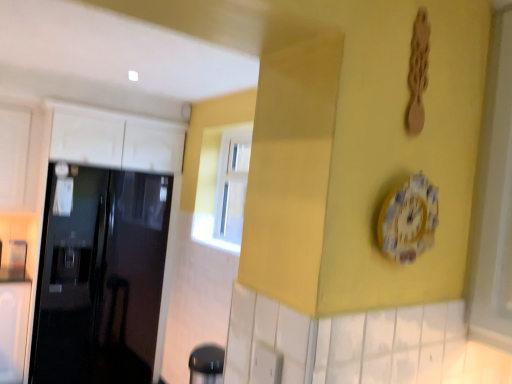
The image size is (512, 384). I want to click on porcelain floral clock at center, so click(x=408, y=219).

The width and height of the screenshot is (512, 384). What do you see at coordinates (408, 219) in the screenshot?
I see `porcelain floral clock at center` at bounding box center [408, 219].

What do you see at coordinates (101, 278) in the screenshot?
I see `glossy black door at left` at bounding box center [101, 278].

The image size is (512, 384). In order to click on glossy black door at left in this screenshot , I will do `click(101, 278)`.

What is the approximate height of glossy black door at left?

It is 1.75 meters.

At what (x,y) coordinates should I click in order to perform the action: click on porcelain floral clock at center. Please return your answer as a coordinate pair (x, y). Looking at the image, I should click on (408, 219).

Visually, is glossy black door at left positioned to the left or to the right of porcelain floral clock at center?

In the image, glossy black door at left appears on the left side of porcelain floral clock at center.

Is the position of glossy black door at left more distant than that of porcelain floral clock at center?

That is True.

Does point (84, 273) appear closer or farther from the camera than point (400, 198)?

Point (84, 273) is farther from the camera than point (400, 198).

From the image's perspective, relative to porcelain floral clock at center, is glossy black door at left above or below?

glossy black door at left is below porcelain floral clock at center.

From a real-world perspective, is glossy black door at left beneath porcelain floral clock at center?

Indeed, from a real-world perspective, glossy black door at left is positioned beneath porcelain floral clock at center.

Which of these two, glossy black door at left or porcelain floral clock at center, is thinner?

porcelain floral clock at center.

Looking at this image, does glossy black door at left have a lesser height compared to porcelain floral clock at center?

Incorrect, the height of glossy black door at left does not fall short of that of porcelain floral clock at center.

Can you confirm if glossy black door at left is smaller than porcelain floral clock at center?

Incorrect, glossy black door at left is not smaller in size than porcelain floral clock at center.

Is glossy black door at left located outside porcelain floral clock at center?

Yes.

Does glossy black door at left touch porcelain floral clock at center?

glossy black door at left and porcelain floral clock at center are not in contact.

Could you tell me if glossy black door at left is facing porcelain floral clock at center?

Yes, glossy black door at left is turned towards porcelain floral clock at center.

You are a GUI agent. You are given a task and a screenshot of the screen. Output one action in this format:
    pyautogui.click(x=<x>, y=<y>)
    Task: Click on the clock lying on the right of glossy black door at left
    The width and height of the screenshot is (512, 384).
    Given the screenshot: What is the action you would take?
    pyautogui.click(x=408, y=219)

Which is more to the right, porcelain floral clock at center or glossy black door at left?

Positioned to the right is porcelain floral clock at center.

Between porcelain floral clock at center and glossy black door at left, which one is positioned behind?

glossy black door at left.

Does point (406, 225) lie in front of point (72, 332)?

Yes, it is in front of point (72, 332).

From the image's perspective, is porcelain floral clock at center positioned above or below glossy black door at left?

From the image's perspective, porcelain floral clock at center appears above glossy black door at left.

From a real-world perspective, between porcelain floral clock at center and glossy black door at left, who is vertically higher?

porcelain floral clock at center.

Which of these two, porcelain floral clock at center or glossy black door at left, is wider?

Wider between the two is glossy black door at left.

Considering the sizes of objects porcelain floral clock at center and glossy black door at left in the image provided, who is shorter, porcelain floral clock at center or glossy black door at left?

porcelain floral clock at center.

Considering the relative sizes of porcelain floral clock at center and glossy black door at left in the image provided, is porcelain floral clock at center bigger than glossy black door at left?

No.

Is porcelain floral clock at center positioned beyond the bounds of glossy black door at left?

Yes, porcelain floral clock at center is outside of glossy black door at left.

Would you consider porcelain floral clock at center to be distant from glossy black door at left?

Yes, porcelain floral clock at center and glossy black door at left are located far from each other.

Could you tell me if porcelain floral clock at center is turned towards glossy black door at left?

No, porcelain floral clock at center is not facing towards glossy black door at left.

Can you tell me how much porcelain floral clock at center and glossy black door at left differ in facing direction?

0.605 degrees.

Locate an element on the screen. door below the porcelain floral clock at center (from a real-world perspective) is located at coordinates (101, 278).

Find the location of a particular element. door behind the porcelain floral clock at center is located at coordinates (101, 278).

The width and height of the screenshot is (512, 384). I want to click on door below the porcelain floral clock at center (from a real-world perspective), so click(101, 278).